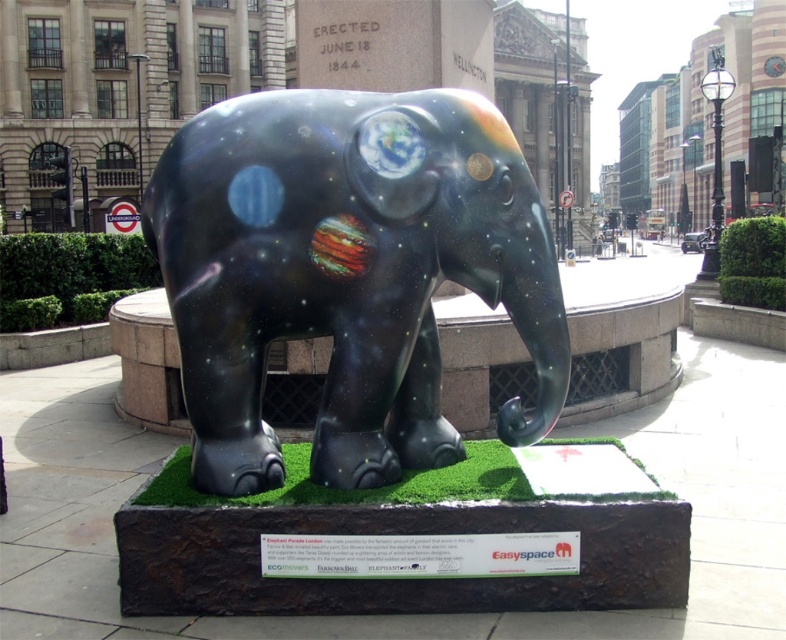
Looking at this image, which of these two, glossy metallic elephant at center or green artificial turf at center, stands taller?

Standing taller between the two is glossy metallic elephant at center.

What do you see at coordinates (346, 273) in the screenshot? This screenshot has height=640, width=786. I see `glossy metallic elephant at center` at bounding box center [346, 273].

Who is more distant from viewer, (174, 244) or (505, 468)?

The point (505, 468) is more distant.

Find the location of `glossy metallic elephant at center`. glossy metallic elephant at center is located at coordinates (346, 273).